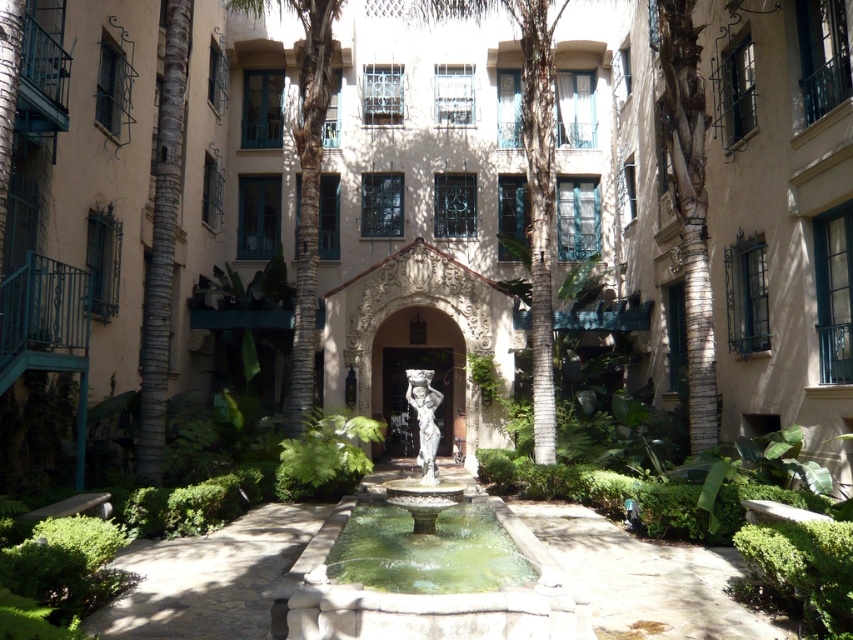
Which is above, green leafy palm tree at center or green stone pool at center?

green leafy palm tree at center is higher up.

In order to click on green leafy palm tree at center in this screenshot , I will do `click(531, 176)`.

Between white stone fountain at center and green stone pool at center, which one is positioned higher?

Positioned higher is white stone fountain at center.

Can you confirm if white stone fountain at center is positioned to the right of green stone pool at center?

No, white stone fountain at center is not to the right of green stone pool at center.

Where is `white stone fountain at center`? The image size is (853, 640). white stone fountain at center is located at coordinates (425, 572).

Based on the photo, does white stone fountain at center have a greater width compared to green leafy palm tree at center?

In fact, white stone fountain at center might be narrower than green leafy palm tree at center.

Can you confirm if white stone fountain at center is smaller than green leafy palm tree at center?

Yes, white stone fountain at center is smaller than green leafy palm tree at center.

Image resolution: width=853 pixels, height=640 pixels. What do you see at coordinates (425, 572) in the screenshot?
I see `white stone fountain at center` at bounding box center [425, 572].

Where is `white stone fountain at center`? white stone fountain at center is located at coordinates (425, 572).